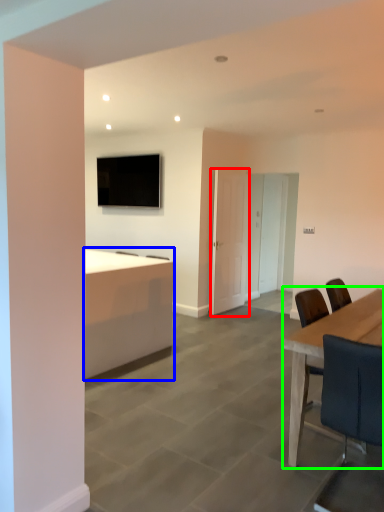
Question: Considering the real-world distances, which object is closest to door (highlighted by a red box)? desk (highlighted by a blue box) or table (highlighted by a green box).

Choices:
 (A) desk
 (B) table

Answer: (A)